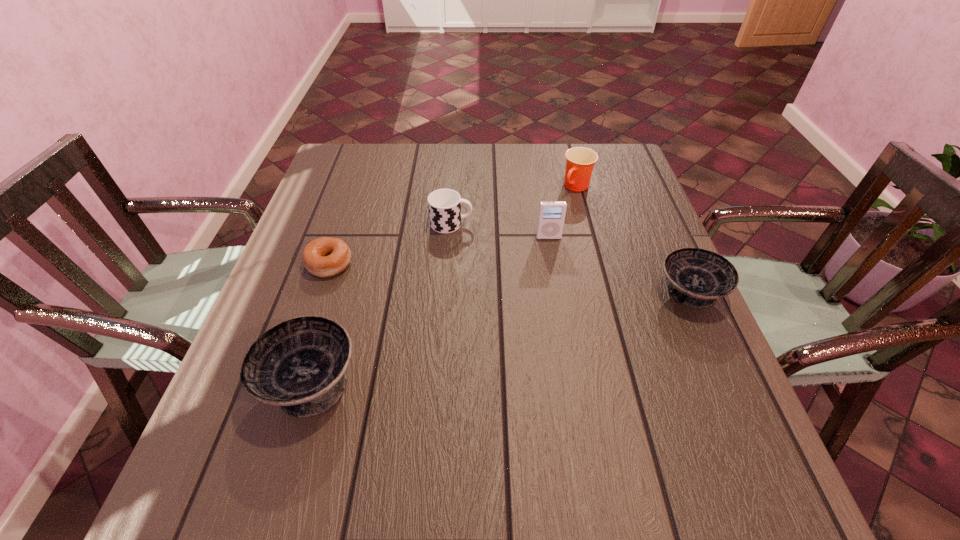
Find the location of a particular element. Image resolution: width=960 pixels, height=540 pixels. the fourth object from left to right is located at coordinates (551, 216).

Find the location of a particular element. The width and height of the screenshot is (960, 540). free region located 0.140m on the right of the nearest object is located at coordinates (434, 382).

Where is `vacant space located on the front of the right bowl`? vacant space located on the front of the right bowl is located at coordinates (713, 346).

What are the coordinates of `blank space located on the right of the bagel` in the screenshot? It's located at (416, 264).

I want to click on free point located on the side of the fifth nearest object with the handle, so click(x=572, y=224).

The width and height of the screenshot is (960, 540). Find the location of `blank space located on the right of the farthest object`. blank space located on the right of the farthest object is located at coordinates (631, 187).

You are a GUI agent. You are given a task and a screenshot of the screen. Output one action in this format:
    pyautogui.click(x=<x>, y=<y>)
    Task: Click on the free space located on the front-facing side of the fourth object from left to right
    
    Given the screenshot: What is the action you would take?
    pyautogui.click(x=560, y=303)

This screenshot has height=540, width=960. Identify the location of object positioned at the far edge. (580, 161).

Image resolution: width=960 pixels, height=540 pixels. In order to click on object positioned at the near edge in this screenshot , I will do `click(299, 364)`.

Identify the location of bowl that is at the left edge. The width and height of the screenshot is (960, 540). (299, 364).